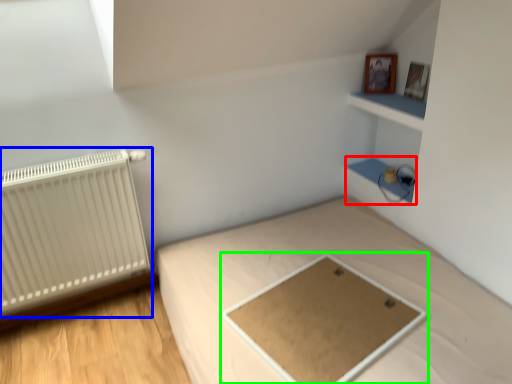
Question: Which is nearer to the cabinet (highlighted by a red box)? radiator (highlighted by a blue box) or table (highlighted by a green box).

Choices:
 (A) radiator
 (B) table

Answer: (B)